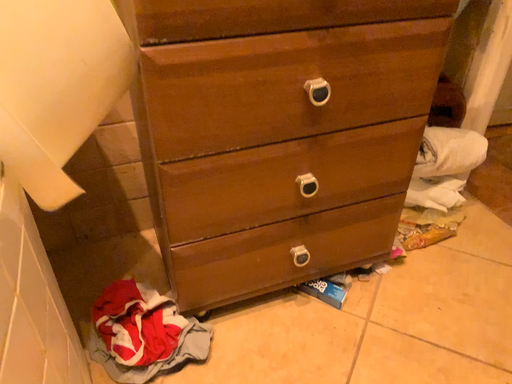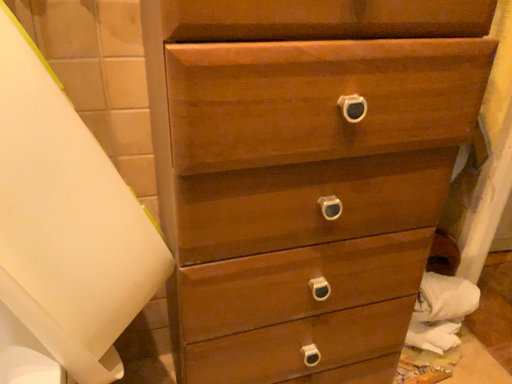
Question: Which way did the camera rotate in the video?

Choices:
 (A) rotated downward
 (B) rotated upward

Answer: (B)